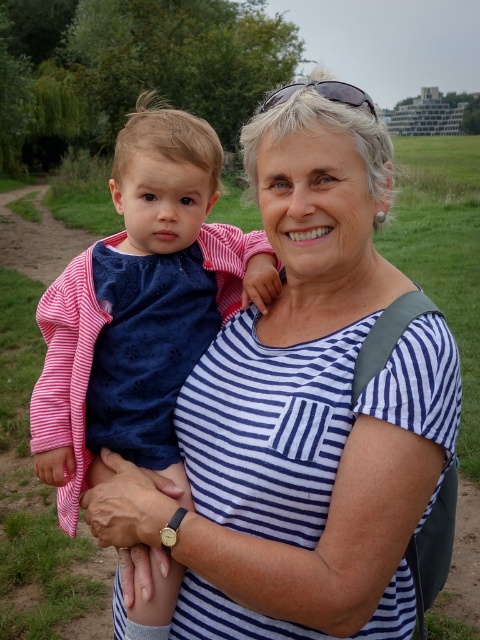
You are a photographer trying to capture a clear shot of both the white striped shirt at center and the matte blue dress at center. Since you can only focus on one subject at a time, which one should you focus on to ensure the other is still somewhat in focus?

You should focus on the white striped shirt at center because it is in front of the matte blue dress at center, so focusing on the closer subject will keep the background subject somewhat in focus.

You are a photographer setting up a photo shoot in a park. You have two outfits to choose from for the main character. The outfits are the white striped shirt at center and the matte blue dress at center. Based on the scene description, which outfit would you recommend for better visibility against the grassy background, and why?

The white striped shirt at center is bigger than the matte blue dress at center, making it more visible against the grassy background.

You are a photographer trying to capture a photo of the white striped shirt at center and the matte blue dress at center. Since you want to frame them properly, can you tell me which one is positioned to the right side of the other?

The white striped shirt at center is to the right of the matte blue dress at center.